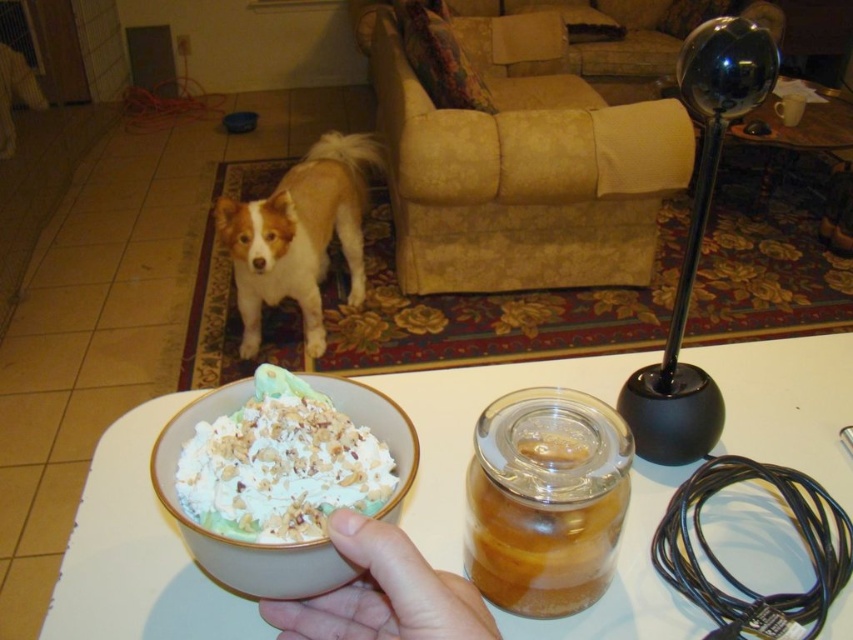
Looking at this image, you are a dog owner who wants to give your dog a treat from the white ceramic bowl at center or the transparent glass jar at center. Which container can you choose if you want to give a larger portion?

The white ceramic bowl at center is larger in size than the transparent glass jar at center, so you can choose the white ceramic bowl at center to give a larger portion.

You are a chef preparing a dessert and have both the white ceramic bowl at center and the transparent glass jar at center on your counter. If you need to store a liquid that requires a lid, which container should you choose?

The transparent glass jar at center should be chosen because it is designed to hold liquids and can be sealed properly, unlike the white ceramic bowl at center which is likely not airtight.